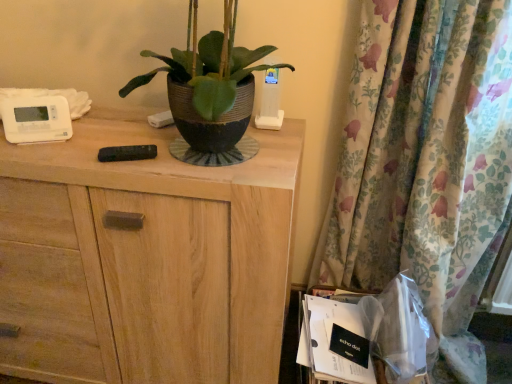
What do you see at coordinates (426, 161) in the screenshot?
I see `floral fabric curtain at right` at bounding box center [426, 161].

Describe the element at coordinates (402, 331) in the screenshot. I see `transparent plastic bag at lower right` at that location.

Identify the location of transparent plastic bag at lower right. coord(402,331).

The image size is (512, 384). Describe the element at coordinates (149, 258) in the screenshot. I see `wooden cabinet at center` at that location.

Find the location of a particular element. floral fabric curtain at right is located at coordinates (426, 161).

Is floral fabric curtain at right turned away from transparent plastic bag at lower right?

Yes, floral fabric curtain at right's orientation is away from transparent plastic bag at lower right.

How different are the orientations of floral fabric curtain at right and transparent plastic bag at lower right in degrees?

floral fabric curtain at right and transparent plastic bag at lower right are facing 0.00262 degrees away from each other.

Considering the relative positions of floral fabric curtain at right and transparent plastic bag at lower right in the image provided, is floral fabric curtain at right to the right of transparent plastic bag at lower right from the viewer's perspective?

Correct, you'll find floral fabric curtain at right to the right of transparent plastic bag at lower right.

Which of these two, floral fabric curtain at right or transparent plastic bag at lower right, is thinner?

transparent plastic bag at lower right is thinner.

Where is `paperback book below the floral fabric curtain at right (from the image's perspective)`? This screenshot has width=512, height=384. paperback book below the floral fabric curtain at right (from the image's perspective) is located at coordinates (329, 341).

Considering the sizes of objects floral fabric curtain at right and white paper at lower right in the image provided, who is wider, floral fabric curtain at right or white paper at lower right?

Wider between the two is floral fabric curtain at right.

Can you confirm if floral fabric curtain at right is bigger than white paper at lower right?

Indeed, floral fabric curtain at right has a larger size compared to white paper at lower right.

Is floral fabric curtain at right shorter than white paper at lower right?

Incorrect, the height of floral fabric curtain at right does not fall short of that of white paper at lower right.

From the image's perspective, is transparent plastic bag at lower right above or below white paper at lower right?

Based on their image positions, transparent plastic bag at lower right is located above white paper at lower right.

Is transparent plastic bag at lower right facing towards white paper at lower right?

No, transparent plastic bag at lower right is not aimed at white paper at lower right.

In the image, there is a white paper at lower right. Where is `paper bag above it (from the image's perspective)`? paper bag above it (from the image's perspective) is located at coordinates (402, 331).

From a real-world perspective, is transparent plastic bag at lower right physically located above or below white paper at lower right?

transparent plastic bag at lower right is situated higher than white paper at lower right in the real world.

Would you say wooden cabinet at center is part of transparent plastic bag at lower right's contents?

No.

Is point (406, 303) positioned after point (206, 344)?

No, it is not.

From the image's perspective, who appears lower, transparent plastic bag at lower right or wooden cabinet at center?

transparent plastic bag at lower right is shown below in the image.

In terms of height, does transparent plastic bag at lower right look taller or shorter compared to wooden cabinet at center?

Considering their sizes, transparent plastic bag at lower right has less height than wooden cabinet at center.

Are wooden cabinet at center and floral fabric curtain at right located far from each other?

No.

Is wooden cabinet at center shorter than floral fabric curtain at right?

Yes, wooden cabinet at center is shorter than floral fabric curtain at right.

Between wooden cabinet at center and floral fabric curtain at right, which one appears on the left side from the viewer's perspective?

wooden cabinet at center is more to the left.

Consider the image. Considering the relative sizes of wooden cabinet at center and white paper at lower right in the image provided, is wooden cabinet at center wider than white paper at lower right?

Indeed, wooden cabinet at center has a greater width compared to white paper at lower right.

Where is `chest of drawers above the white paper at lower right (from a real-world perspective)`? chest of drawers above the white paper at lower right (from a real-world perspective) is located at coordinates (149, 258).

From the picture: Is wooden cabinet at center oriented away from white paper at lower right?

No.

Between wooden cabinet at center and white paper at lower right, which one has smaller size?

white paper at lower right.

Looking at this image, which object is positioned more to the left, wooden cabinet at center or transparent plastic bag at lower right?

From the viewer's perspective, wooden cabinet at center appears more on the left side.

Which object is closer to the camera taking this photo, wooden cabinet at center or transparent plastic bag at lower right?

wooden cabinet at center is in front.

How different are the orientations of wooden cabinet at center and transparent plastic bag at lower right in degrees?

wooden cabinet at center and transparent plastic bag at lower right are facing 0.000885 degrees away from each other.

From the image's perspective, relative to transparent plastic bag at lower right, is wooden cabinet at center above or below?

wooden cabinet at center is situated higher than transparent plastic bag at lower right in the image.

This screenshot has width=512, height=384. In order to click on paper bag located below the floral fabric curtain at right (from the image's perspective) in this screenshot , I will do point(402,331).

Locate an element on the screen. The width and height of the screenshot is (512, 384). paperback book located underneath the floral fabric curtain at right (from a real-world perspective) is located at coordinates pos(329,341).

Estimate the real-world distances between objects in this image. Which object is closer to wooden cabinet at center, white paper at lower right or transparent plastic bag at lower right?

white paper at lower right lies closer to wooden cabinet at center than the other object.

Based on their spatial positions, is floral fabric curtain at right or white paper at lower right closer to transparent plastic bag at lower right?

white paper at lower right is positioned closer to the anchor transparent plastic bag at lower right.

Which object lies nearer to the anchor point floral fabric curtain at right, transparent plastic bag at lower right or wooden cabinet at center?

Among the two, transparent plastic bag at lower right is located nearer to floral fabric curtain at right.

Consider the image. Which object lies nearer to the anchor point transparent plastic bag at lower right, floral fabric curtain at right or wooden cabinet at center?

Among the two, floral fabric curtain at right is located nearer to transparent plastic bag at lower right.

Which object lies nearer to the anchor point wooden cabinet at center, floral fabric curtain at right or white paper at lower right?

Based on the image, white paper at lower right appears to be nearer to wooden cabinet at center.

Estimate the real-world distances between objects in this image. Which object is closer to white paper at lower right, wooden cabinet at center or floral fabric curtain at right?

floral fabric curtain at right lies closer to white paper at lower right than the other object.

Based on their spatial positions, is white paper at lower right or wooden cabinet at center further from floral fabric curtain at right?

wooden cabinet at center is further to floral fabric curtain at right.

Looking at the image, which one is located further to floral fabric curtain at right, wooden cabinet at center or transparent plastic bag at lower right?

Among the two, wooden cabinet at center is located further to floral fabric curtain at right.

What are the coordinates of `paperback book situated between wooden cabinet at center and transparent plastic bag at lower right from left to right` in the screenshot? It's located at (329, 341).

This screenshot has height=384, width=512. I want to click on paperback book situated between wooden cabinet at center and floral fabric curtain at right from left to right, so click(x=329, y=341).

At what (x,y) coordinates should I click in order to perform the action: click on paper bag between wooden cabinet at center and floral fabric curtain at right in the horizontal direction. Please return your answer as a coordinate pair (x, y). This screenshot has height=384, width=512. Looking at the image, I should click on [x=402, y=331].

The width and height of the screenshot is (512, 384). What are the coordinates of `paper bag between floral fabric curtain at right and white paper at lower right vertically` in the screenshot? It's located at (402, 331).